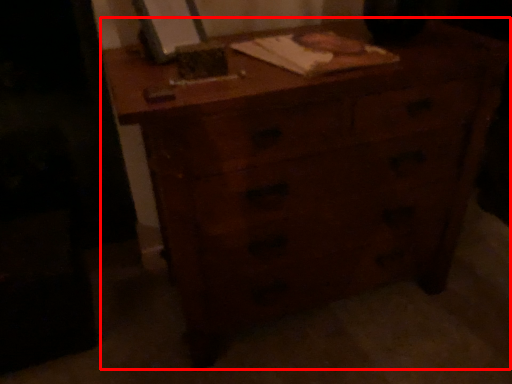
Question: From the image's perspective, what is the correct spatial relationship of chest of drawers (annotated by the red box) in relation to notebook?

Choices:
 (A) below
 (B) above

Answer: (A)